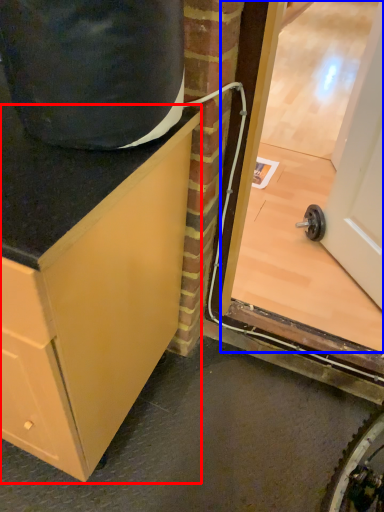
Question: Which object is closer to the camera taking this photo, cabinetry (highlighted by a red box) or glass door (highlighted by a blue box)?

Choices:
 (A) cabinetry
 (B) glass door

Answer: (A)